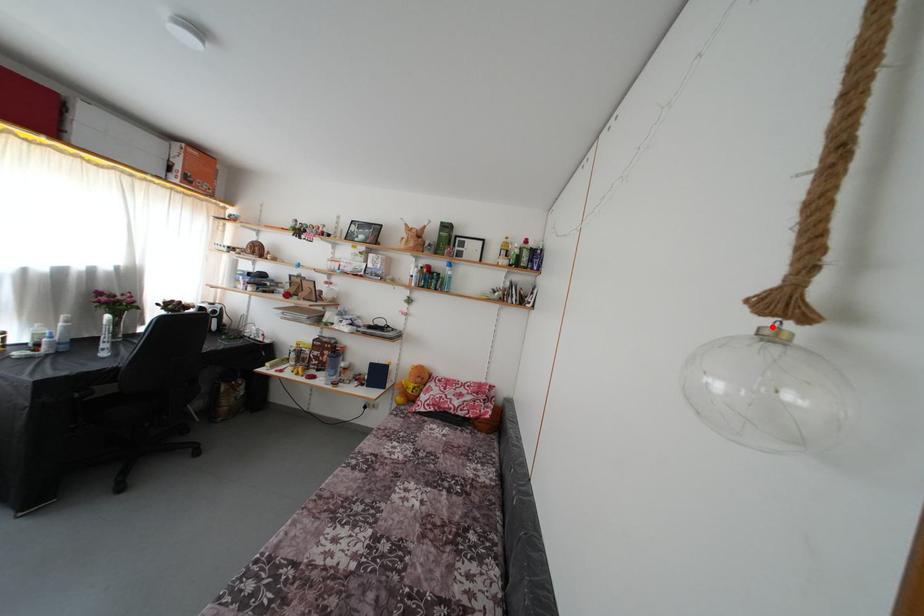
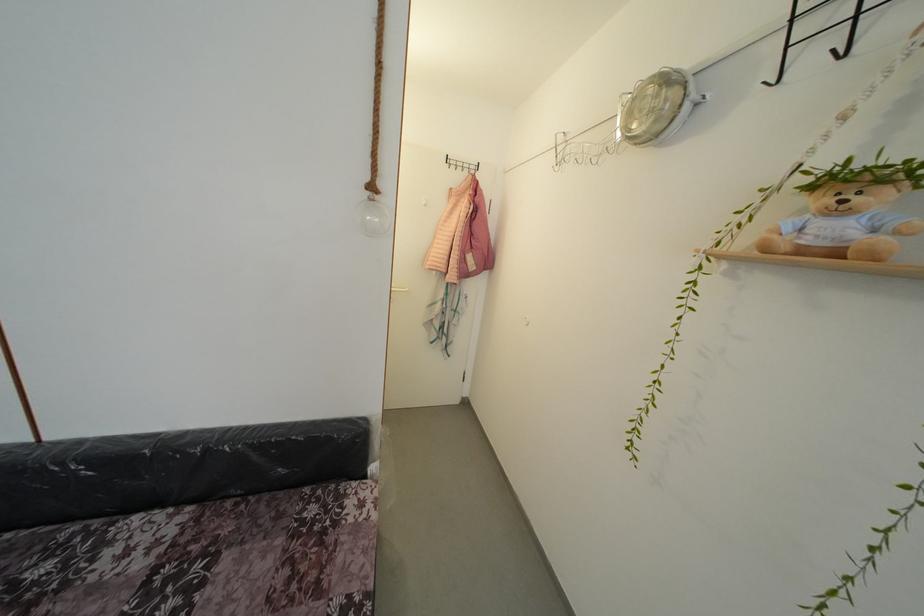
The point at the highlighted location is marked in the first image. Where is the corresponding point in the second image?

(373, 199)